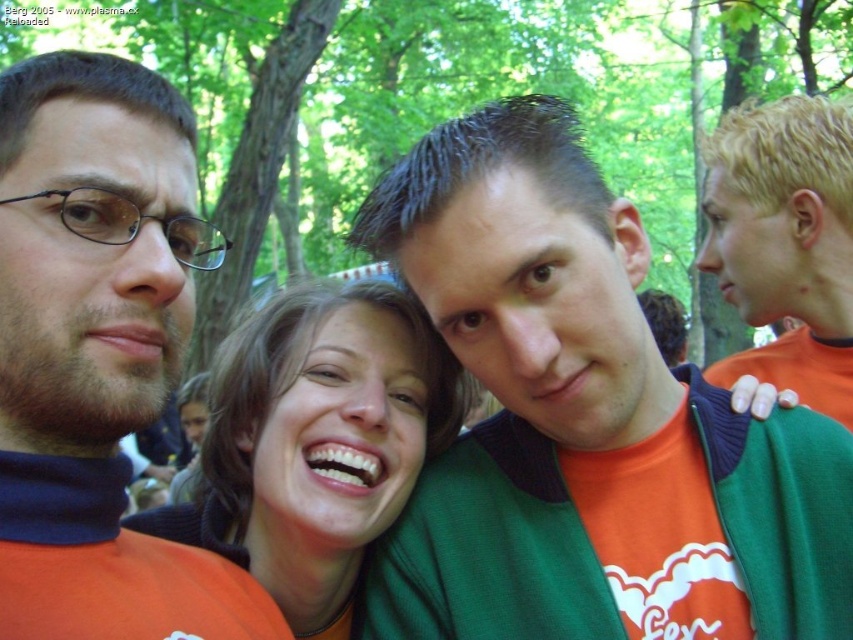
Does matte orange shirt at center appear on the left side of blonde hair at right?

Yes, matte orange shirt at center is to the left of blonde hair at right.

Does matte orange shirt at center have a lesser height compared to blonde hair at right?

Yes, matte orange shirt at center is shorter than blonde hair at right.

Does point (299, 504) lie in front of point (755, 161)?

Yes, point (299, 504) is closer to viewer.

Where is `matte orange shirt at center`? The image size is (853, 640). matte orange shirt at center is located at coordinates (316, 442).

Is matte orange turtleneck at left further to camera compared to matte orange shirt at center?

That is False.

Measure the distance from matte orange turtleneck at left to matte orange shirt at center.

matte orange turtleneck at left and matte orange shirt at center are 79.66 centimeters apart from each other.

Is point (112, 524) less distant than point (357, 561)?

Yes, point (112, 524) is in front of point (357, 561).

I want to click on matte orange turtleneck at left, so click(x=97, y=355).

Can you confirm if matte orange turtleneck at left is positioned to the right of blonde hair at right?

Incorrect, matte orange turtleneck at left is not on the right side of blonde hair at right.

Between matte orange turtleneck at left and blonde hair at right, which one appears on the left side from the viewer's perspective?

Positioned to the left is matte orange turtleneck at left.

Is point (96, 406) positioned after point (837, 236)?

No.

The width and height of the screenshot is (853, 640). Identify the location of matte orange turtleneck at left. (97, 355).